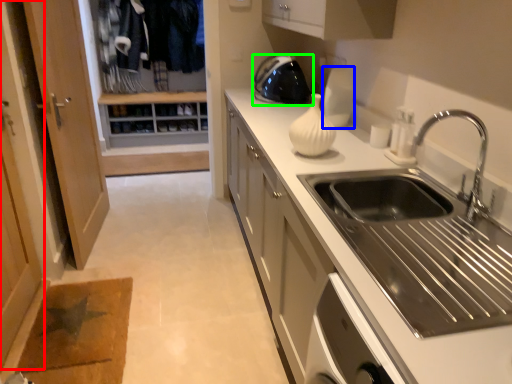
Question: Which object is positioned closest to screen door (highlighted by a red box)? Select from appliance (highlighted by a blue box) and home appliance (highlighted by a green box).

Choices:
 (A) appliance
 (B) home appliance

Answer: (B)